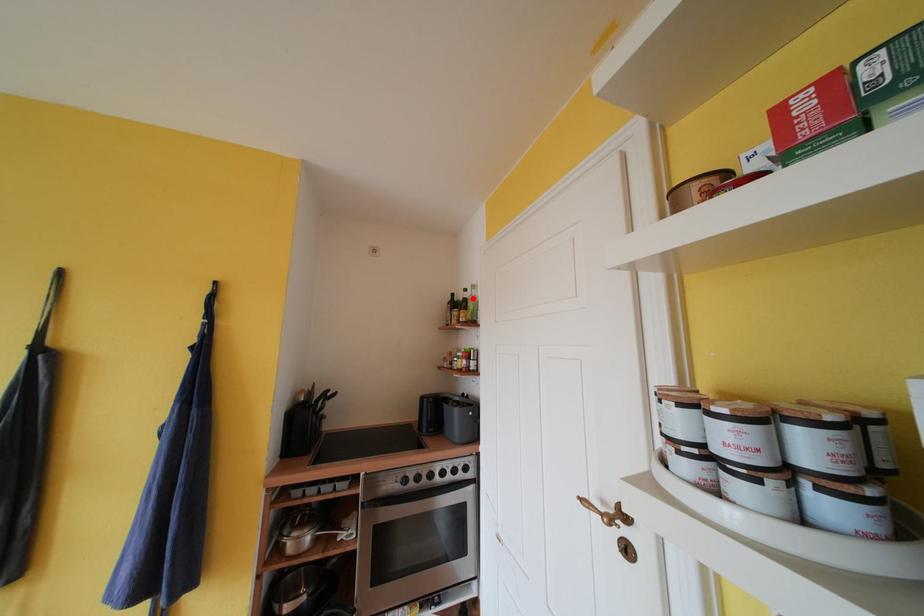
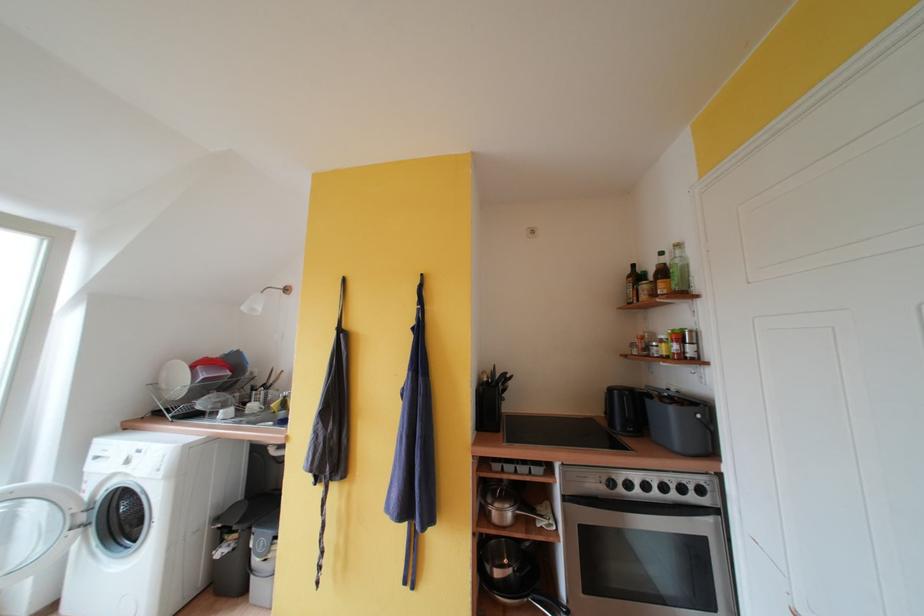
The point at the highlighted location is marked in the first image. Where is the corresponding point in the second image?

(671, 262)